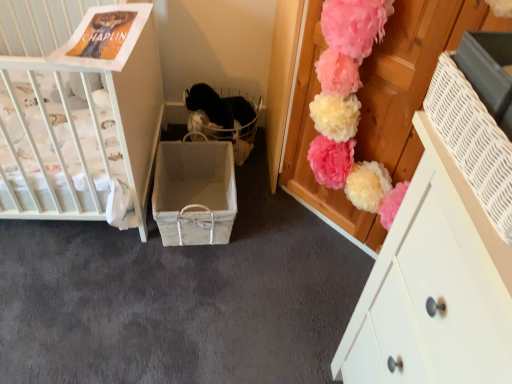
Question: Is white painted wood cabinet at upper right inside the boundaries of white wicker basket at center, which ranks as the 2th storage box in front-to-back order, or outside?

Choices:
 (A) outside
 (B) inside

Answer: (A)

Question: Looking at their shapes, would you say white painted wood cabinet at upper right is wider or thinner than white wicker basket at center, which is the first storage box from back to front?

Choices:
 (A) thin
 (B) wide

Answer: (A)

Question: Estimate the real-world distances between objects in this image. Which object is closer to the white painted wood cabinet at upper right?

Choices:
 (A) white wicker basket at center, which ranks as the 2th storage box in front-to-back order
 (B) black wicker basket at center
 (C) white wicker crib at left
 (D) white wicker basket at right, marked as the 1th storage box in a right-to-left arrangement

Answer: (D)

Question: Estimate the real-world distances between objects in this image. Which object is closer to the white wicker basket at center, the first storage box in the left-to-right sequence?

Choices:
 (A) white painted wood cabinet at upper right
 (B) white wicker crib at left
 (C) white wicker basket at right, which is the 2th storage box from back to front
 (D) black wicker basket at center

Answer: (D)